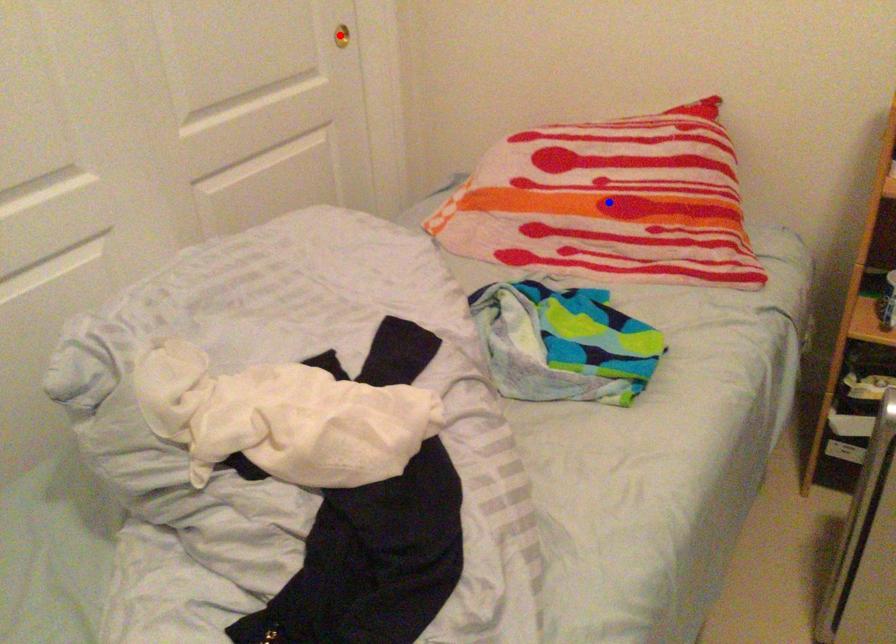
Question: Two points are marked on the image. Which point is closer to the camera?

Choices:
 (A) Blue point is closer.
 (B) Red point is closer.

Answer: (A)